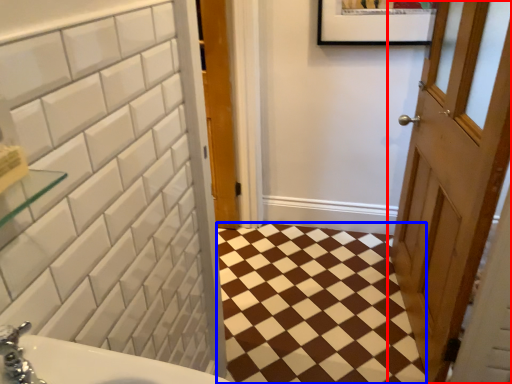
Question: Which object appears closest to the camera in this image, door (highlighted by a red box) or ceramic tile (highlighted by a blue box)?

Choices:
 (A) door
 (B) ceramic tile

Answer: (A)